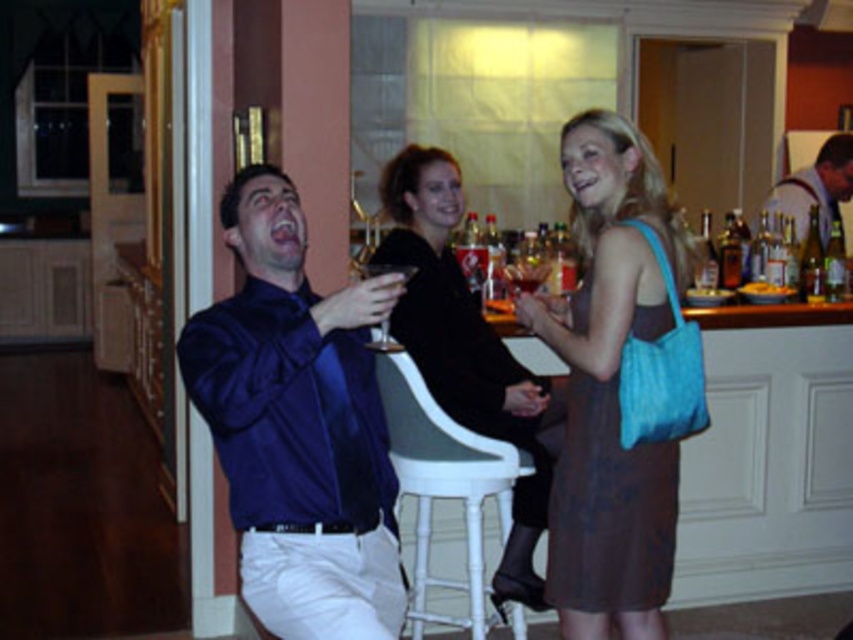
Does point (283, 232) lie behind point (567, 131)?

No.

Which is below, satin blue shirt at left or matte brown dress at center?

matte brown dress at center is lower down.

Does point (228, 378) lie in front of point (640, 179)?

Yes, point (228, 378) is in front of point (640, 179).

This screenshot has width=853, height=640. Find the location of `satin blue shirt at left`. satin blue shirt at left is located at coordinates (299, 426).

How distant is satin blue shirt at left from silvery metallic tie at upper right?

satin blue shirt at left and silvery metallic tie at upper right are 11.57 feet apart.

In order to click on satin blue shirt at left in this screenshot , I will do pyautogui.click(x=299, y=426).

Locate an element on the screen. This screenshot has width=853, height=640. satin blue shirt at left is located at coordinates (299, 426).

This screenshot has width=853, height=640. Find the location of `satin blue shirt at left`. satin blue shirt at left is located at coordinates (299, 426).

Which is above, silvery metallic tie at upper right or transparent glass at center?

silvery metallic tie at upper right is higher up.

Can you confirm if silvery metallic tie at upper right is wider than transparent glass at center?

Yes.

Measure the distance between point (817, 188) and camera.

A distance of 5.21 meters exists between point (817, 188) and camera.

Identify the location of silvery metallic tie at upper right. This screenshot has height=640, width=853. (816, 186).